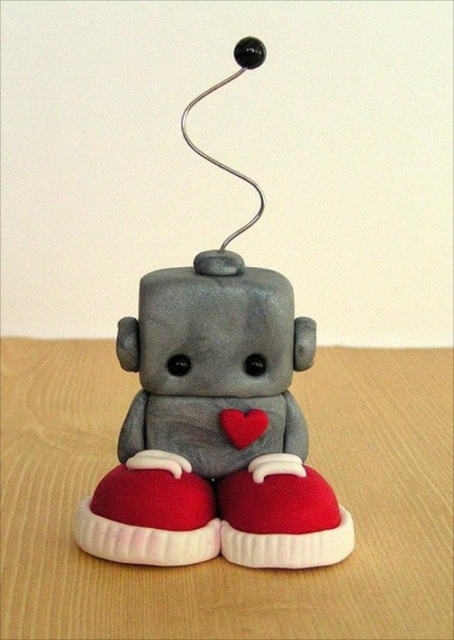
You are designing a small display stand for the robot figurine. The stand must accommodate both the matte red shoe at lower center and the red matte heart at center. What is the minimum distance the stand should be designed to ensure both elements fit comfortably?

The minimum distance the stand should be designed is at least 5.36 inches to accommodate the space between the matte red shoe at lower center and the red matte heart at center.

You are placing a small toy on the wooden table at center. The toy has a height of 10 cm. Can the red matte heart at center on the table support the toy without falling over?

The wooden table at center is taller than the red matte heart at center, so the red matte heart at center may not have enough height to support the toy. The toy might topple over if placed on the red matte heart at center.

You are taking a photo of the robot figurine and notice two points marked on it. The first point is at coordinates point (59,541) and the second is at point (222,428). Which point will appear larger in your photo?

Point (59,541) is closer to the camera than point (222,428), so it will appear larger in the photo.